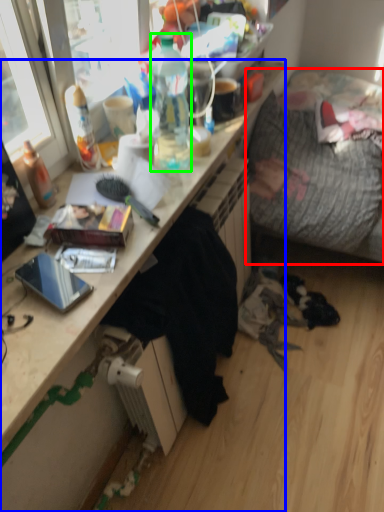
Question: Which is nearer to the studio couch (highlighted by a red box)? desk (highlighted by a blue box) or bottle (highlighted by a green box).

Choices:
 (A) desk
 (B) bottle

Answer: (B)